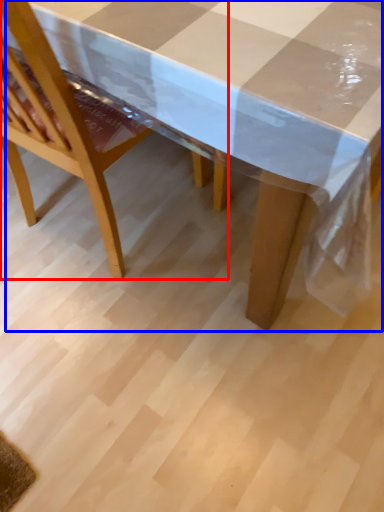
Question: Among these objects, which one is farthest to the camera, chair (highlighted by a red box) or picnic table (highlighted by a blue box)?

Choices:
 (A) chair
 (B) picnic table

Answer: (A)